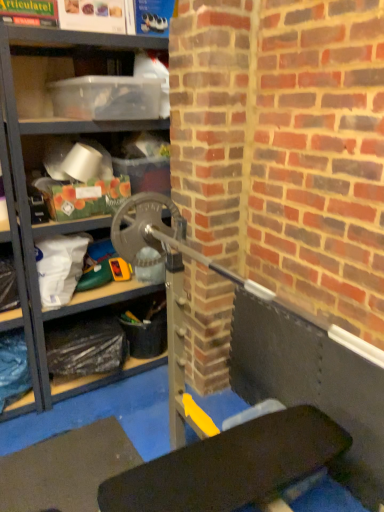
Describe the element at coordinates (35, 164) in the screenshot. I see `matte black shelf at left` at that location.

Find the location of a particular element. matte black shelf at left is located at coordinates (35, 164).

Find the location of a particular element. The width and height of the screenshot is (384, 512). matte black shelf at left is located at coordinates (35, 164).